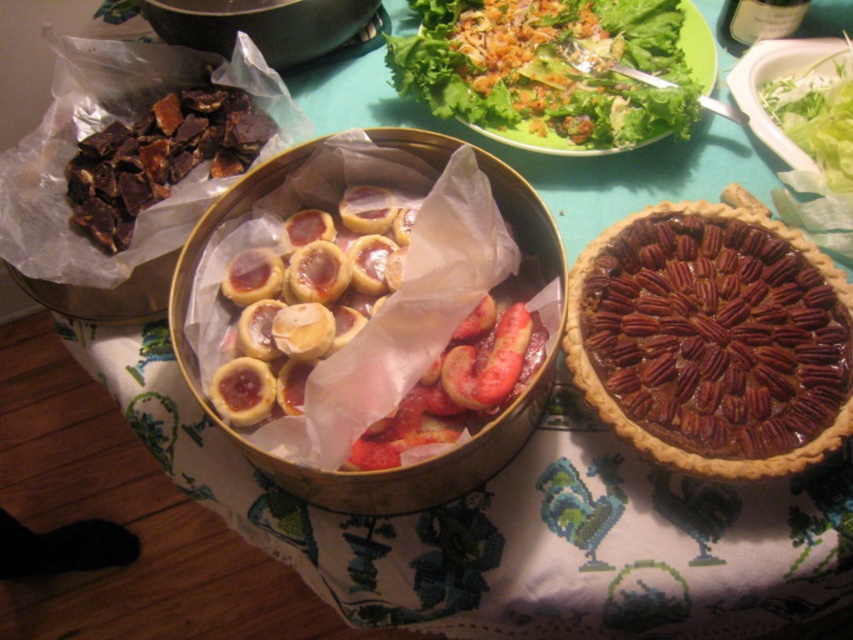
You are a food critic evaluating the table setting. You notice the brown crumbly pie at center right and the green leafy salad at upper center. Which of these two items has a greater height?

The green leafy salad at upper center is taller than the brown crumbly pie at center right because the brown crumbly pie at center right is thinner than the green leafy salad at upper center.

In the scene shown: You are a guest at a dinner party and want to reach for both the green leafy salad at upper center and the shiny brown pie at center. Which one is closer to your right hand?

The green leafy salad at upper center is to the right of the shiny brown pie at center, so it is closer to your right hand.

You are a guest at a dinner party and want to reach for the green leafy salad at upper center and the shiny brown pie at center. Which one is closer to you?

The green leafy salad at upper center is shorter than the shiny brown pie at center, so it is closer to you.